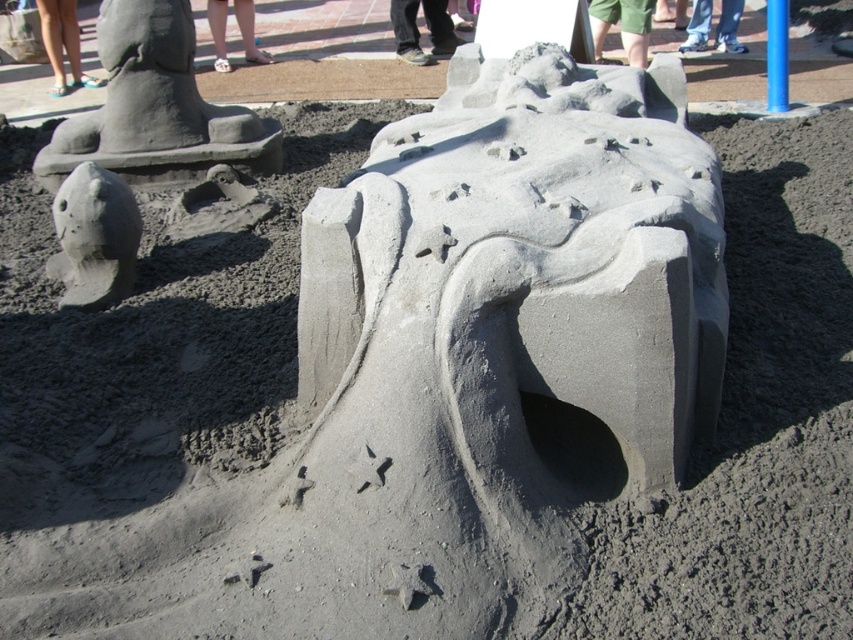
Describe the element at coordinates (62, 44) in the screenshot. The width and height of the screenshot is (853, 640). I see `blue flip-flops at lower left` at that location.

From the picture: Can you confirm if blue flip-flops at lower left is shorter than tan skin foot at lower center?

Incorrect, blue flip-flops at lower left's height does not fall short of tan skin foot at lower center's.

The width and height of the screenshot is (853, 640). What are the coordinates of `blue flip-flops at lower left` in the screenshot? It's located at (62, 44).

Does gray sand sculpture at upper left appear under tan skin foot at lower center?

Yes.

Which is below, gray sand sculpture at upper left or tan skin foot at lower center?

gray sand sculpture at upper left is below.

Describe the element at coordinates (155, 106) in the screenshot. I see `gray sand sculpture at upper left` at that location.

What are the coordinates of `gray sand sculpture at upper left` in the screenshot? It's located at (155, 106).

Is gray sand sculpture at left bigger than brown leather shoes at center?

No.

Describe the element at coordinates (94, 237) in the screenshot. This screenshot has height=640, width=853. I see `gray sand sculpture at left` at that location.

The width and height of the screenshot is (853, 640). Find the location of `gray sand sculpture at left`. gray sand sculpture at left is located at coordinates (94, 237).